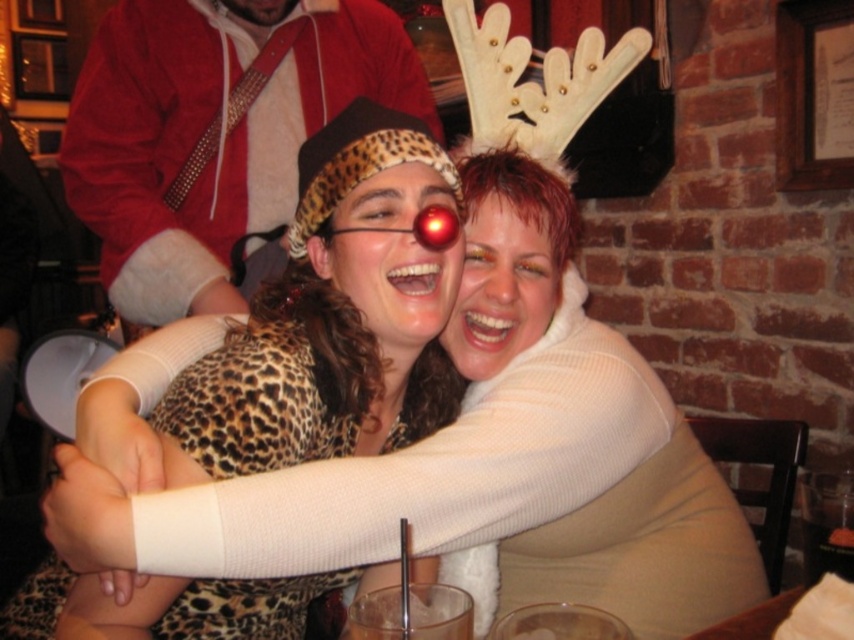
Question: Can you confirm if red velvet santa hat at upper left is bigger than leopard print sweater at center?

Choices:
 (A) yes
 (B) no

Answer: (A)

Question: Which point is closer to the camera taking this photo?

Choices:
 (A) (196, 189)
 (B) (427, 180)

Answer: (B)

Question: Among these points, which one is nearest to the camera?

Choices:
 (A) 299,317
 (B) 237,154

Answer: (A)

Question: Is red velvet santa hat at upper left further to the viewer compared to leopard print sweater at center?

Choices:
 (A) yes
 (B) no

Answer: (A)

Question: Is red velvet santa hat at upper left closer to the viewer compared to leopard print sweater at center?

Choices:
 (A) yes
 (B) no

Answer: (B)